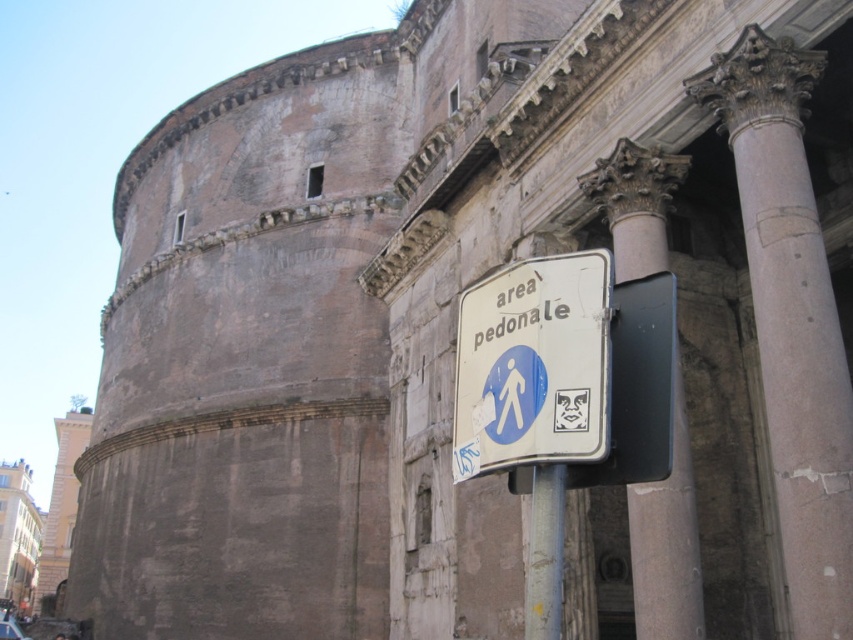
You are standing at the Pantheon in Rome and want to take a photo of the dome. There are two points marked on the ground where you can stand. One is at point (614, 202) and the other at point (558, 488). Which point should you choose to ensure the dome is fully visible in your photo?

You should choose point (558, 488) because point (614, 202) is behind it, so standing at point (558, 488) will give you a clearer view of the dome without obstruction.